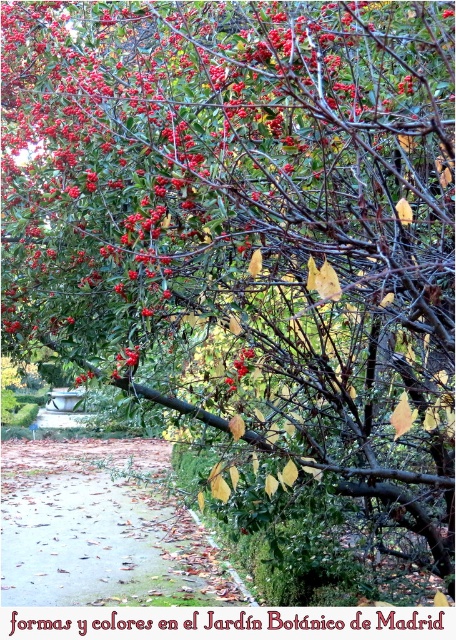
You are standing at the center of the Jard?n Bot?nico de Madrid and see a point marked at coordinates point (102, 529). According to the image, where is this point located?

The point (102, 529) is on the brown leafy path at lower left.

You are a visitor at the Jardn Botnico de Madrid and want to take a photo of the smooth red berries at center without the brown leafy path at lower left blocking the view. Can you step forward to frame the berries better?

The smooth red berries at center is behind the brown leafy path at lower left, so stepping forward might bring the berries into focus while moving the path out of the frame, allowing for a clearer photo without obstruction.